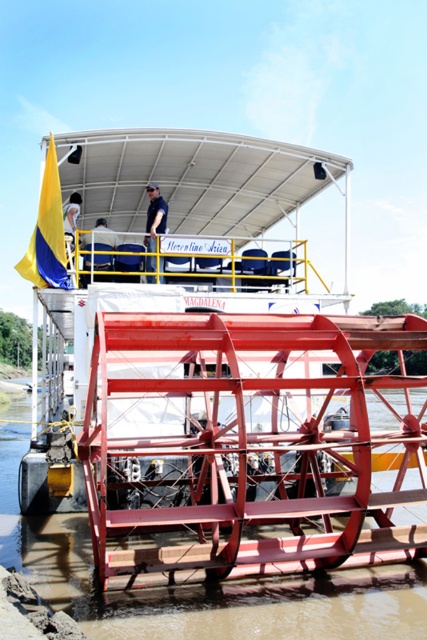
Measure the distance between metallic red paddlewheel at center and camera.

metallic red paddlewheel at center is 5.38 meters away from camera.

Between metallic red paddlewheel at center and brown metallic river at lower center, which one is positioned higher?

Positioned higher is metallic red paddlewheel at center.

Does point (269, 221) come farther from viewer compared to point (380, 586)?

That is True.

Image resolution: width=427 pixels, height=640 pixels. I want to click on metallic red paddlewheel at center, so click(218, 378).

In the scene shown: Can you confirm if metallic red paddlewheel at center is shorter than blue fabric shirt at upper center?

Incorrect, metallic red paddlewheel at center's height does not fall short of blue fabric shirt at upper center's.

Between point (249, 278) and point (102, 237), which one is positioned behind?

Positioned behind is point (102, 237).

I want to click on metallic red paddlewheel at center, so click(x=218, y=378).

Does blue fabric shirt at upper center appear on the right side of dark blue shirt at upper center?

In fact, blue fabric shirt at upper center is to the left of dark blue shirt at upper center.

Which is more to the right, blue fabric shirt at upper center or dark blue shirt at upper center?

From the viewer's perspective, dark blue shirt at upper center appears more on the right side.

The image size is (427, 640). I want to click on blue fabric shirt at upper center, so click(99, 237).

In order to click on blue fabric shirt at upper center in this screenshot , I will do `click(99, 237)`.